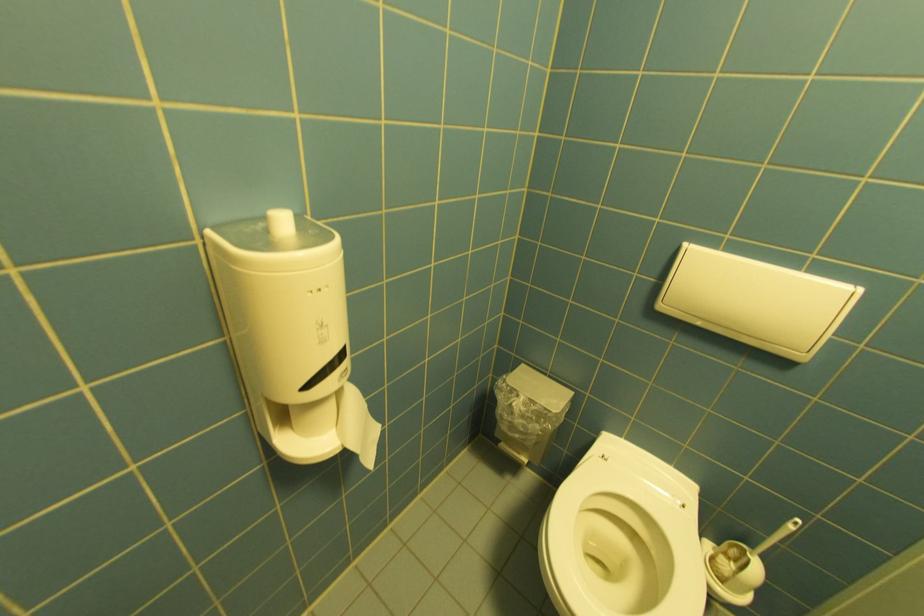
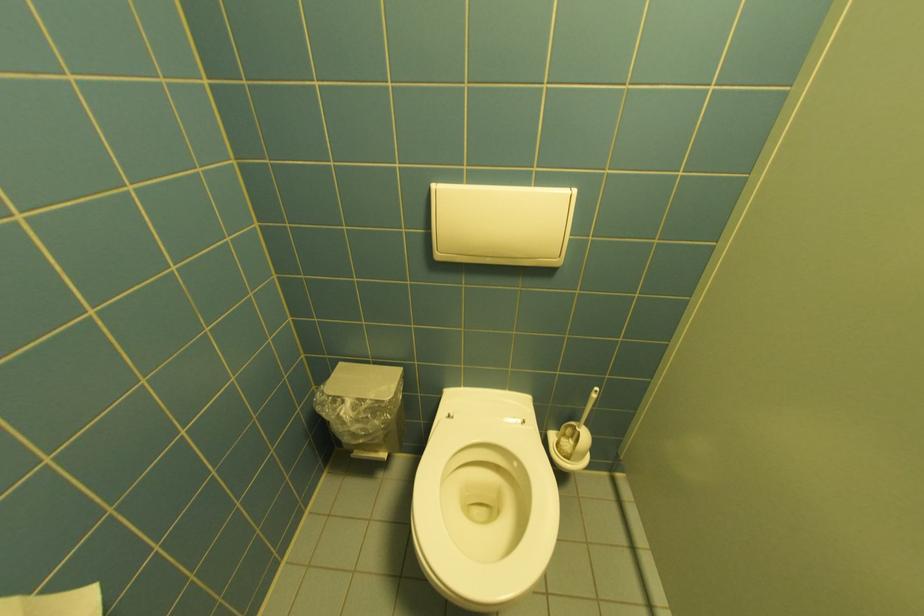
Question: The camera is either moving clockwise (left) or counter-clockwise (right) around the object. The first image is from the beginning of the video and the second image is from the end. Is the camera moving left or right when shooting the video?

Choices:
 (A) Left
 (B) Right

Answer: (A)